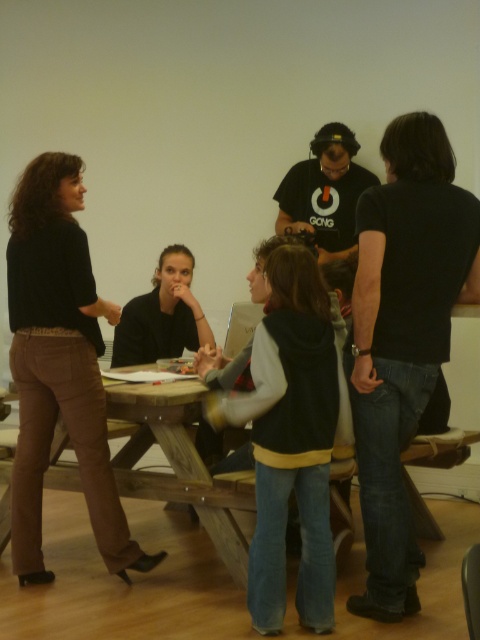
In the scene shown: You are standing at the origin point of the coordinate system in the room. You want to walk to the black cotton shirt at right. What direction should you move in to reach it?

The black cotton shirt at right is located at coordinate point [404,337]. Since you are at the origin, you should move towards the positive x and y directions to reach it.

You are organizing a photo shoot and need to arrange the participants according to their shirt types. You have two people wearing black shirts in the scene. One is wearing a black cotton shirt at right and another in a black matte shirt at center. Based on their positions, which participant should be moved to the left side of the frame to maintain symmetry?

The black cotton shirt at right should be moved to the left side of the frame to mirror its current position, creating symmetry with the black matte shirt at center remaining in the center.

In the scene, there is a point marked at coordinates (404, 337). Based on the description, which object does this point correspond to?

The point at coordinates (404, 337) corresponds to the black cotton shirt at right.